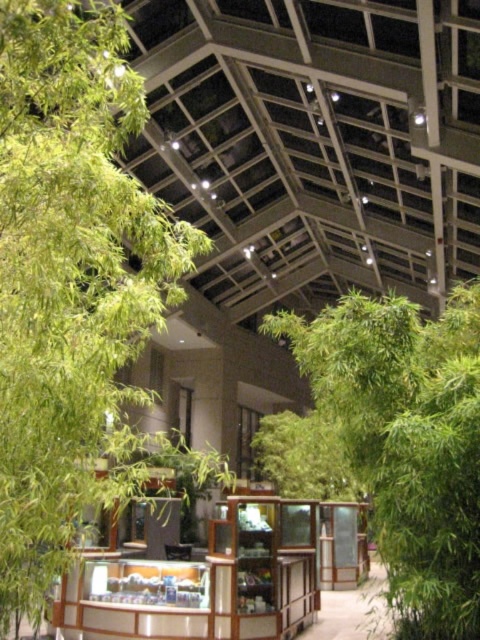
Question: Considering the real-world distances, which object is farthest from the green leafy bamboo at right?

Choices:
 (A) wooden display case at center
 (B) green leafy tree at left

Answer: (B)

Question: Which is farther from the green leafy bamboo at right?

Choices:
 (A) wooden display case at center
 (B) green leafy tree at left

Answer: (B)

Question: Can you confirm if green leafy bamboo at right is thinner than wooden display case at center?

Choices:
 (A) yes
 (B) no

Answer: (B)

Question: Which of these objects is positioned farthest from the green leafy tree at left?

Choices:
 (A) wooden display case at center
 (B) green leafy bamboo at right

Answer: (B)

Question: Is green leafy tree at left below green leafy bamboo at right?

Choices:
 (A) no
 (B) yes

Answer: (A)

Question: Is green leafy bamboo at right below wooden display case at center?

Choices:
 (A) yes
 (B) no

Answer: (B)